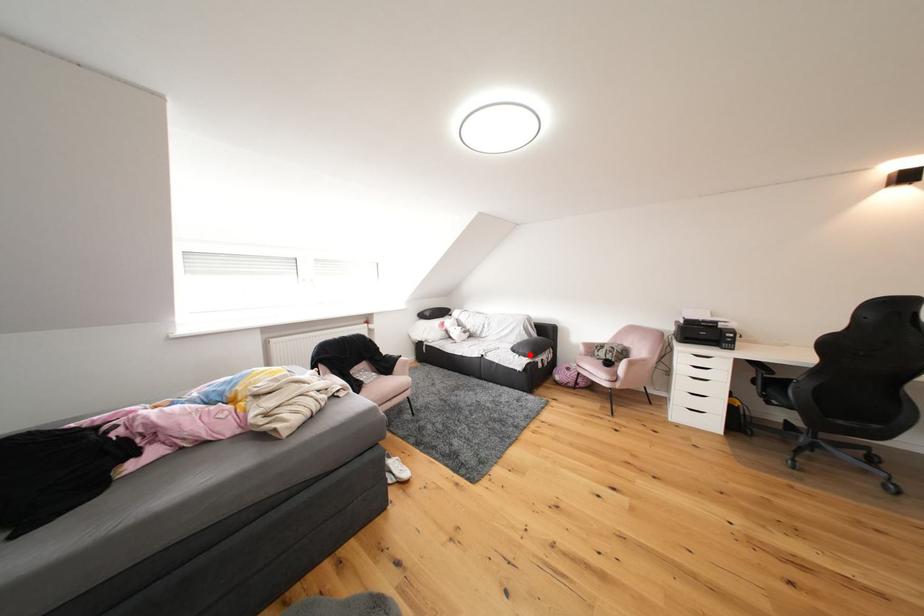
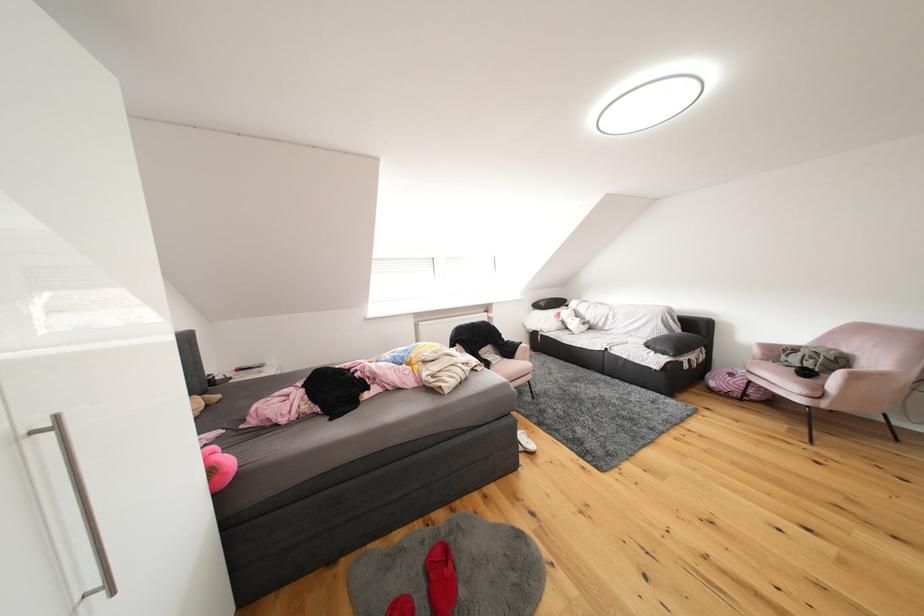
Where in the second image is the point corresponding to the highlighted location from the first image?

(667, 351)